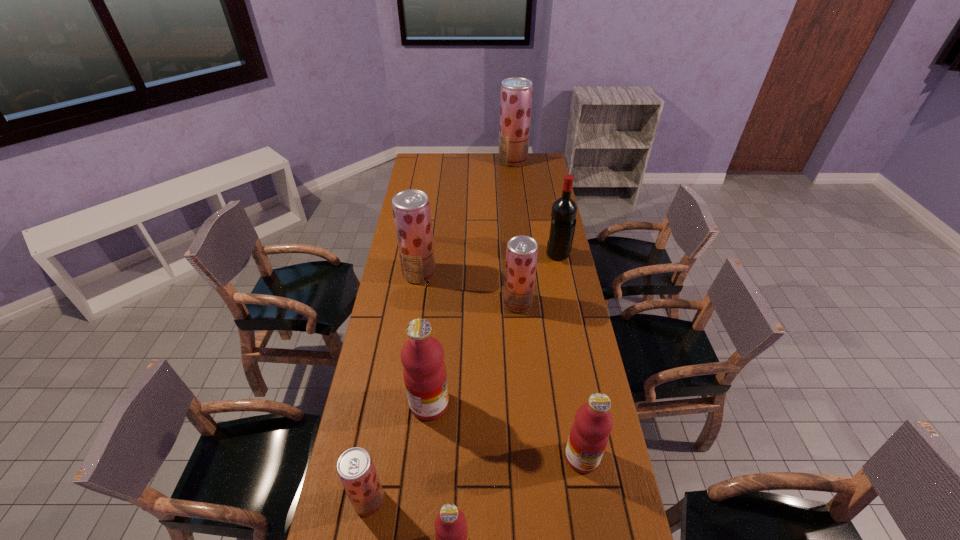
Identify the location of vacant area between the third smallest strawberry fruit juice and the sixth farthest object. This screenshot has height=540, width=960. (501, 366).

In order to click on vacant space in between the third farthest strawberry fruit juice and the second biggest pink fruit juice in this screenshot , I will do click(550, 380).

The height and width of the screenshot is (540, 960). Identify the location of free space between the farthest fruit juice and the third nearest object. (547, 309).

In order to click on object that is the sixth closest to the nearest strawberry fruit juice in this screenshot , I will do `click(563, 215)`.

Identify which object is the sixth closest to the third nearest object. Please provide its 2D coordinates. Your answer should be formatted as a tuple, i.e. [(x, y)], where the tuple contains the x and y coordinates of a point satisfying the conditions above.

[(411, 208)]

Where is `the sixth closest fruit juice to the wine bottle`? This screenshot has width=960, height=540. the sixth closest fruit juice to the wine bottle is located at coordinates (355, 468).

Locate which fruit juice is the fifth closest to the fourth nearest fruit juice. Please provide its 2D coordinates. Your answer should be formatted as a tuple, i.e. [(x, y)], where the tuple contains the x and y coordinates of a point satisfying the conditions above.

[(411, 208)]

Identify which strawberry fruit juice is located as the fourth nearest to the smallest pink fruit juice. Please provide its 2D coordinates. Your answer should be formatted as a tuple, i.e. [(x, y)], where the tuple contains the x and y coordinates of a point satisfying the conditions above.

[(516, 92)]

Locate which strawberry fruit juice is the third closest to the second farthest fruit juice. Please provide its 2D coordinates. Your answer should be formatted as a tuple, i.e. [(x, y)], where the tuple contains the x and y coordinates of a point satisfying the conditions above.

[(516, 92)]

Locate an element on the screen. This screenshot has height=540, width=960. pink fruit juice identified as the closest to the farthest strawberry fruit juice is located at coordinates (422, 356).